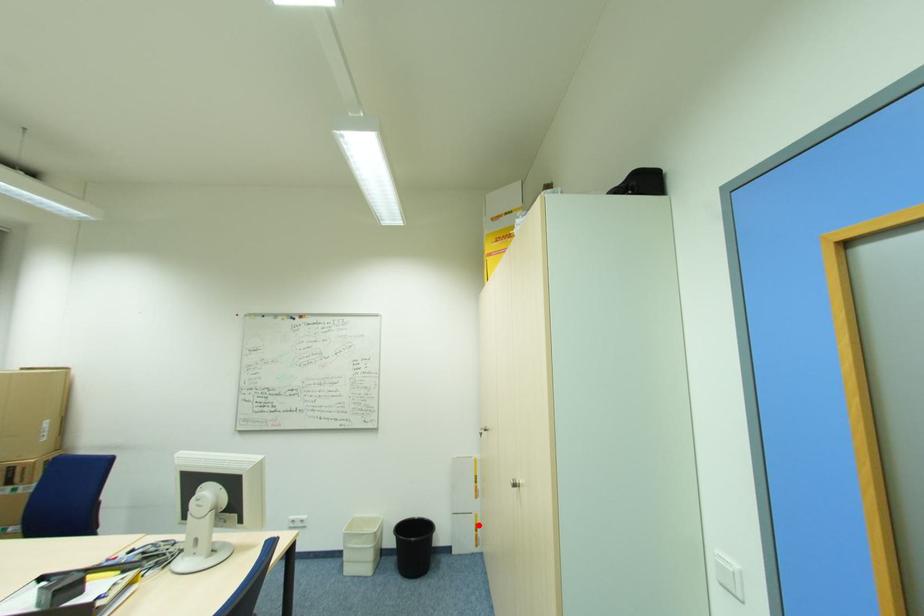
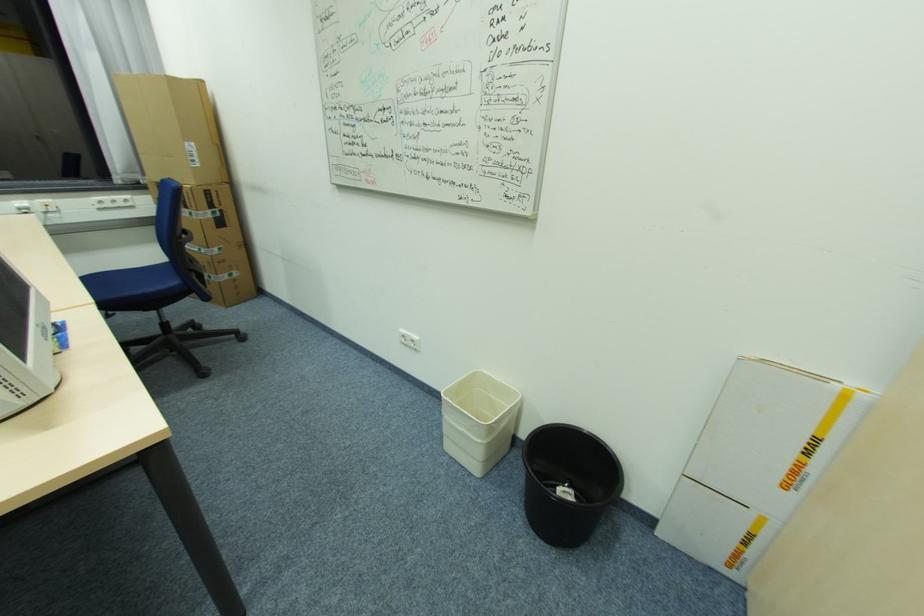
Question: I am providing you with two images of the same scene from different viewpoints. Image1 has a red point marked. In image2, the corresponding 3D location appears at what relative position? Reply with the corresponding letter.

Choices:
 (A) Closer
 (B) Farther

Answer: (A)